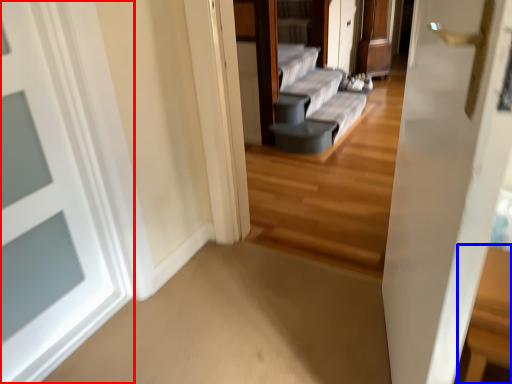
Question: Which of the following is the farthest to the observer, door (highlighted by a red box) or table (highlighted by a blue box)?

Choices:
 (A) door
 (B) table

Answer: (B)